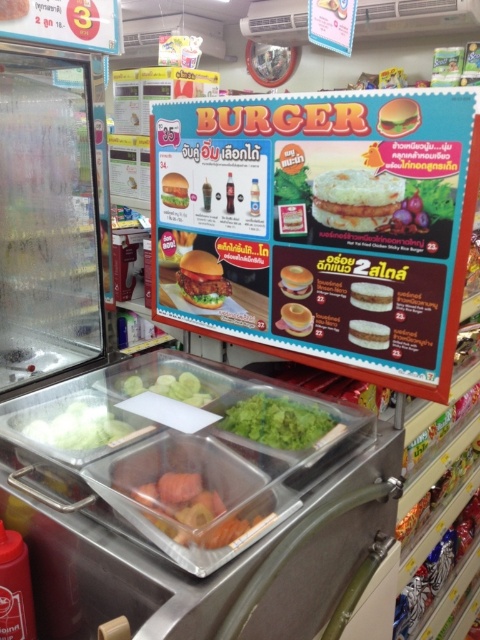
Question: Can you confirm if green matte cucumber at center is positioned to the left of matte brown burger at center?

Choices:
 (A) yes
 (B) no

Answer: (B)

Question: Which point is closer to the camera?

Choices:
 (A) (379, 307)
 (B) (96, 410)

Answer: (A)

Question: Which point is farther from the camera taking this photo?

Choices:
 (A) pyautogui.click(x=387, y=285)
 (B) pyautogui.click(x=189, y=387)

Answer: (B)

Question: Does matte plastic burger menu at upper center appear under matte plastic hamburger at center?

Choices:
 (A) no
 (B) yes

Answer: (B)

Question: Estimate the real-world distances between objects in this image. Which object is farther from the golden crispy hamburger at center?

Choices:
 (A) green matte cucumber at center
 (B) green leafy lettuce at center

Answer: (A)

Question: Does matte plastic hamburger at center have a lesser width compared to matte brown burger at center?

Choices:
 (A) no
 (B) yes

Answer: (A)